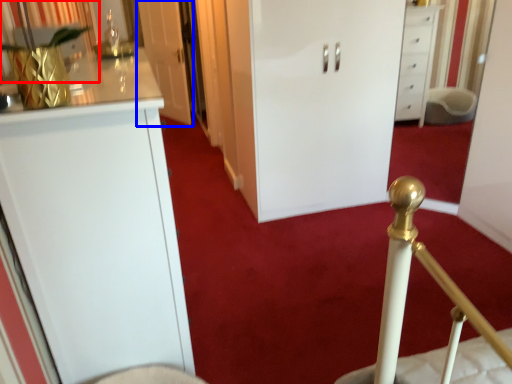
Question: Which object is closer to the camera taking this photo, curtain (highlighted by a red box) or door (highlighted by a blue box)?

Choices:
 (A) curtain
 (B) door

Answer: (A)